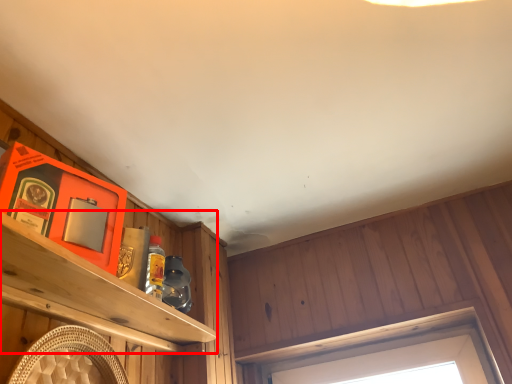
Question: From the image's perspective, what is the correct spatial relationship of shelf (annotated by the red box) in relation to window?

Choices:
 (A) above
 (B) below

Answer: (A)